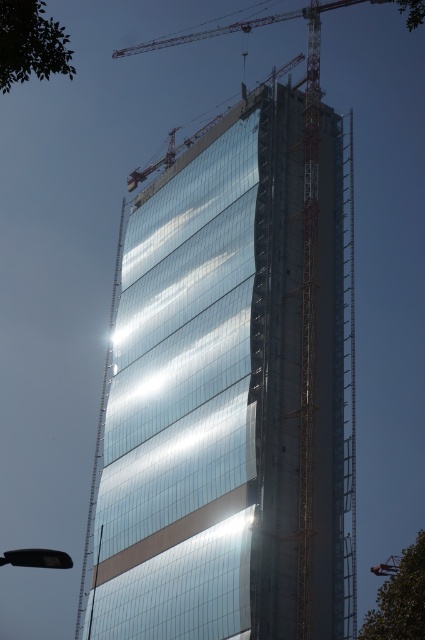
Between point (271, 570) and point (201, 125), which one is positioned in front?

Point (271, 570)

Based on the photo, who is positioned more to the left, transparent glass building at center or metallic yellow crane at upper center?

transparent glass building at center

The image size is (425, 640). What do you see at coordinates (206, 394) in the screenshot?
I see `transparent glass building at center` at bounding box center [206, 394].

This screenshot has width=425, height=640. Identify the location of transparent glass building at center. (206, 394).